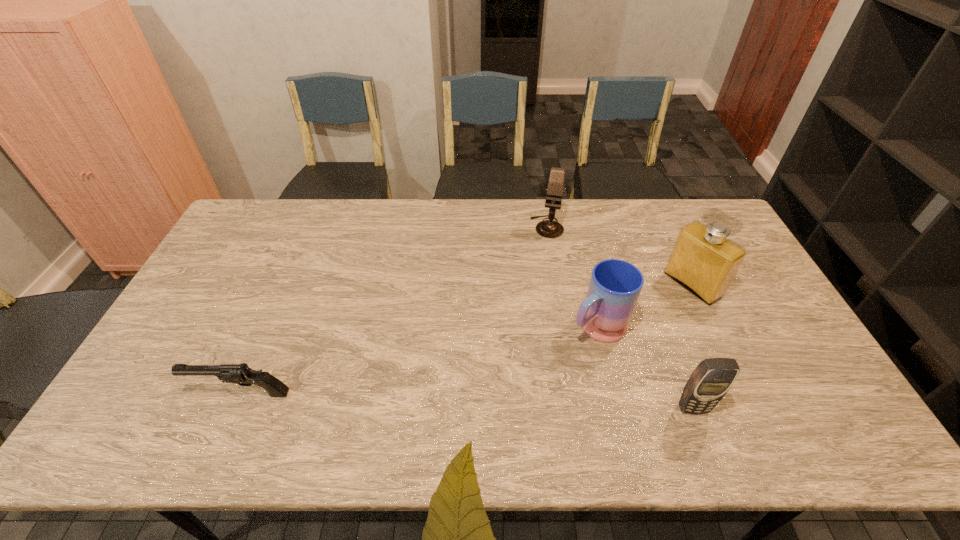
The image size is (960, 540). I want to click on object present at the far edge, so click(x=547, y=228).

You are a GUI agent. You are given a task and a screenshot of the screen. Output one action in this format:
    pyautogui.click(x=<x>, y=<y>)
    Task: Click on the gun that is at the near edge
    Image resolution: width=960 pixels, height=540 pixels.
    Given the screenshot: What is the action you would take?
    pyautogui.click(x=241, y=374)

I want to click on cellular telephone that is at the near edge, so click(x=710, y=381).

Identify the location of object that is at the left edge. (241, 374).

This screenshot has width=960, height=540. Identify the location of object present at the right edge. (703, 260).

Where is `object located in the near left corner section of the desktop`? This screenshot has width=960, height=540. object located in the near left corner section of the desktop is located at coordinates (241, 374).

Find the location of a particular element. free region at the far edge of the desktop is located at coordinates coord(415,228).

In the image, there is a desktop. At what (x,y) coordinates should I click in order to perform the action: click on vacant space at the near edge. Please return your answer as a coordinate pair (x, y). Image resolution: width=960 pixels, height=540 pixels. Looking at the image, I should click on (600, 387).

This screenshot has width=960, height=540. Find the location of `vacant position at the left edge of the desktop`. vacant position at the left edge of the desktop is located at coordinates (251, 249).

Identify the location of vacant space at the right edge of the desktop. The height and width of the screenshot is (540, 960). (756, 297).